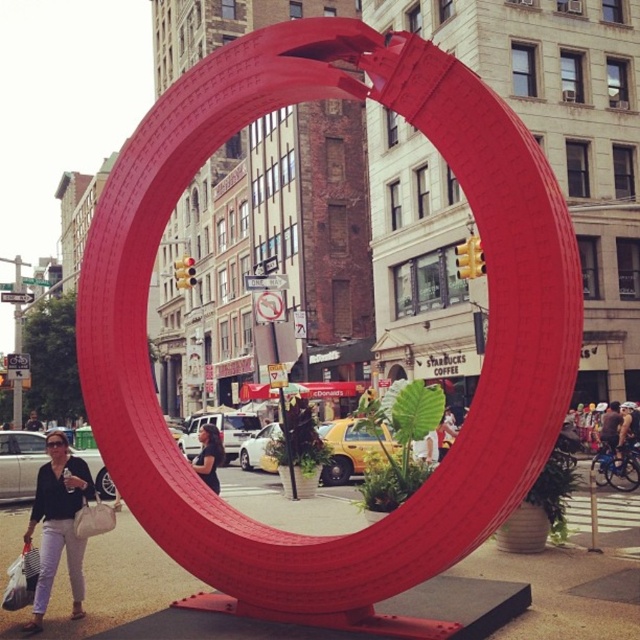
The width and height of the screenshot is (640, 640). What do you see at coordinates (58, 524) in the screenshot?
I see `matte black shirt at lower left` at bounding box center [58, 524].

Is matte black shirt at lower left above matte black shirt at center?

Correct, matte black shirt at lower left is located above matte black shirt at center.

Is point (67, 477) positioned behind point (212, 490)?

No, (67, 477) is in front of (212, 490).

Find the location of a particular element. This screenshot has width=640, height=640. matte black shirt at lower left is located at coordinates (58, 524).

Consider the image. Who is more forward, (292, 561) or (45, 538)?

Positioned in front is point (292, 561).

Which of these two, matte red sculpture at center or matte black shirt at lower left, stands taller?

matte red sculpture at center is taller.

Measure the distance between matte red sculpture at center and camera.

The distance of matte red sculpture at center from camera is 13.88 meters.

This screenshot has width=640, height=640. Identify the location of matte red sculpture at center. (486, 321).

Is matte red sculpture at center wider than matte black shirt at center?

Yes, matte red sculpture at center is wider than matte black shirt at center.

Image resolution: width=640 pixels, height=640 pixels. Find the location of `matte red sculpture at center`. matte red sculpture at center is located at coordinates (486, 321).